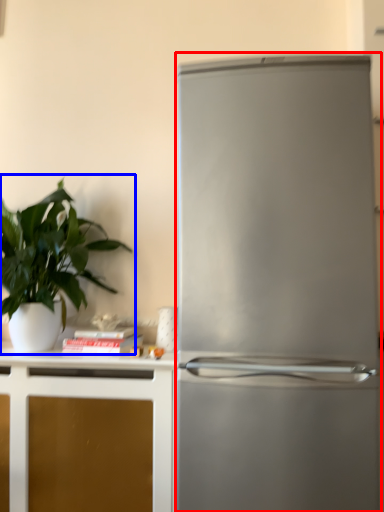
Question: Which object is closer to the camera taking this photo, refrigerator (highlighted by a red box) or houseplant (highlighted by a blue box)?

Choices:
 (A) refrigerator
 (B) houseplant

Answer: (A)